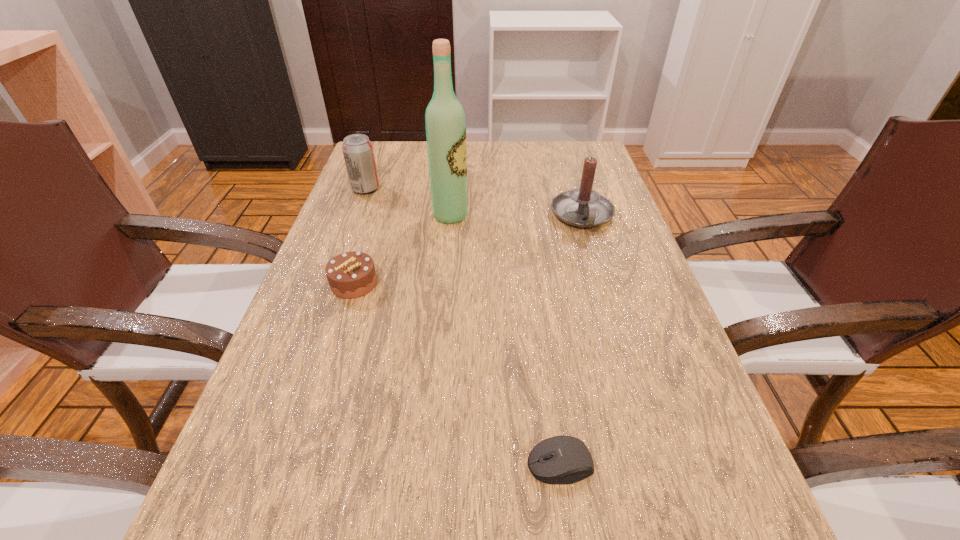
Locate an element on the screen. This screenshot has width=960, height=540. free spot between the chocolate cake and the nearest object is located at coordinates (457, 374).

Select which object appears as the closest to the fourth farthest object. Please provide its 2D coordinates. Your answer should be formatted as a tuple, i.e. [(x, y)], where the tuple contains the x and y coordinates of a point satisfying the conditions above.

[(445, 124)]

Select which object is the closest to the rightmost object. Please provide its 2D coordinates. Your answer should be formatted as a tuple, i.e. [(x, y)], where the tuple contains the x and y coordinates of a point satisfying the conditions above.

[(445, 124)]

In order to click on vacant position in the image that satisfies the following two spatial constraints: 1. on the front-facing side of the tallest object; 2. on the left side of the nearest object in this screenshot , I will do `click(428, 464)`.

The height and width of the screenshot is (540, 960). I want to click on free space in the image that satisfies the following two spatial constraints: 1. on the back side of the nearest object; 2. on the front-facing side of the third object from left to right, so click(x=526, y=215).

Identify the location of vacant space that satisfies the following two spatial constraints: 1. on the front side of the chocolate cake; 2. on the right side of the computer equipment. (298, 464).